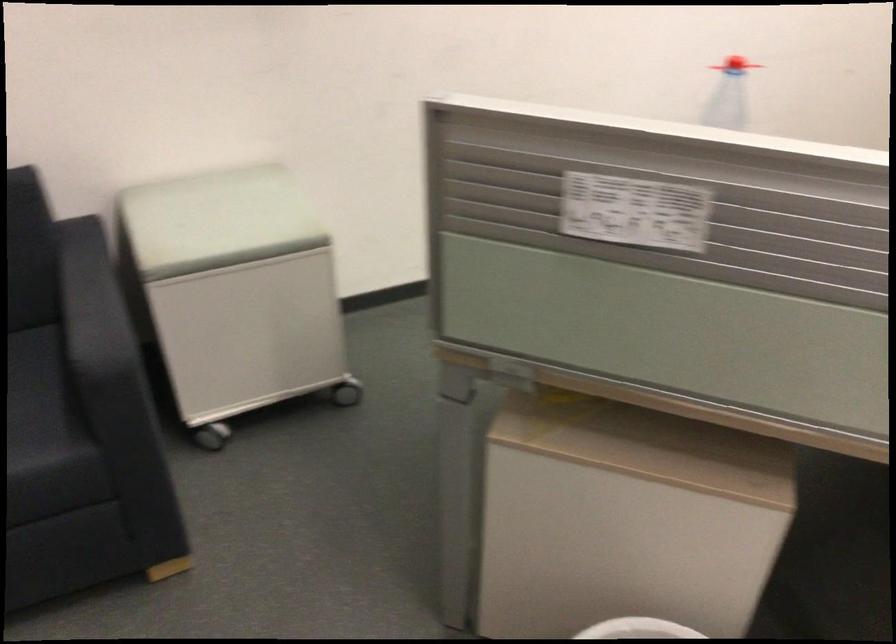
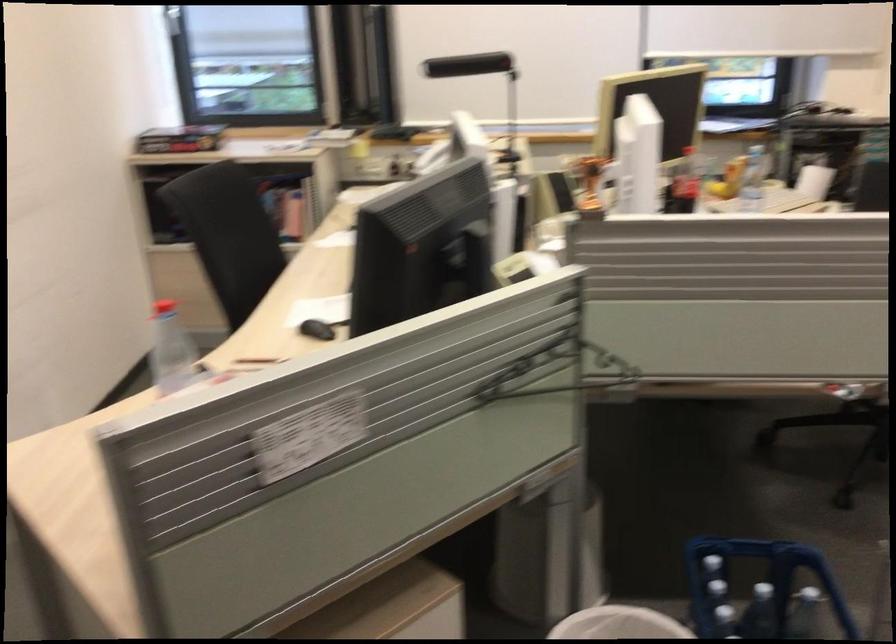
Question: The images are taken continuously from a first-person perspective. In which direction is your viewpoint rotating?

Choices:
 (A) Left
 (B) Right
 (C) Up
 (D) Down

Answer: (B)